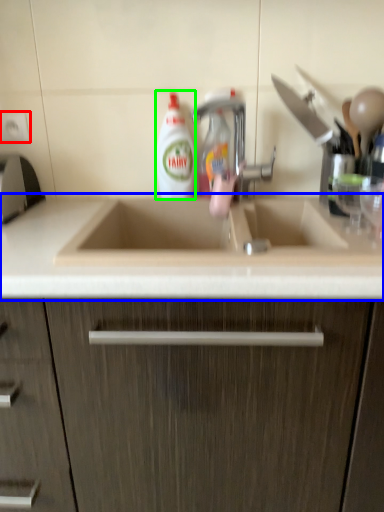
Question: Estimate the real-world distances between objects in this image. Which object is closer to electric outlet (highlighted by a red box), countertop (highlighted by a blue box) or cleaning product (highlighted by a green box)?

Choices:
 (A) countertop
 (B) cleaning product

Answer: (B)